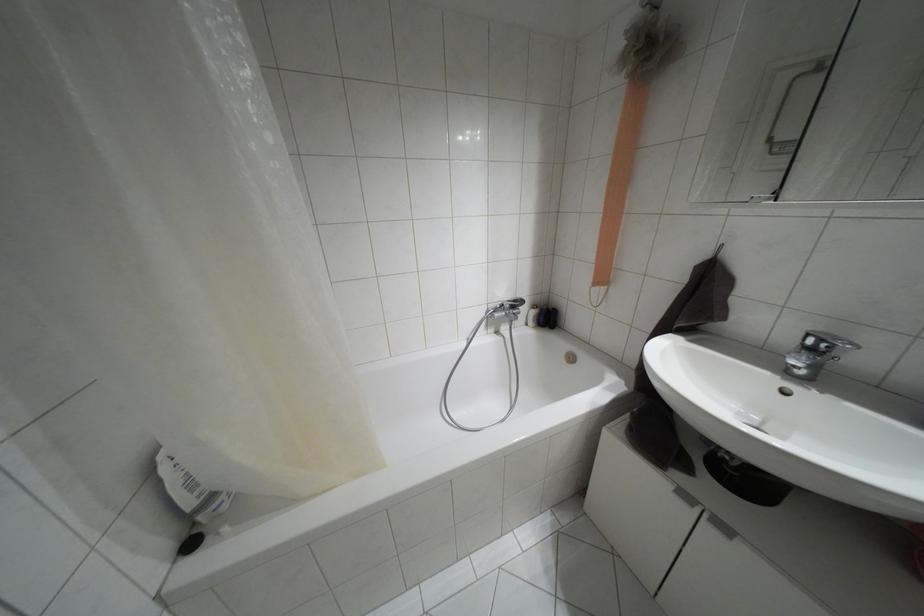
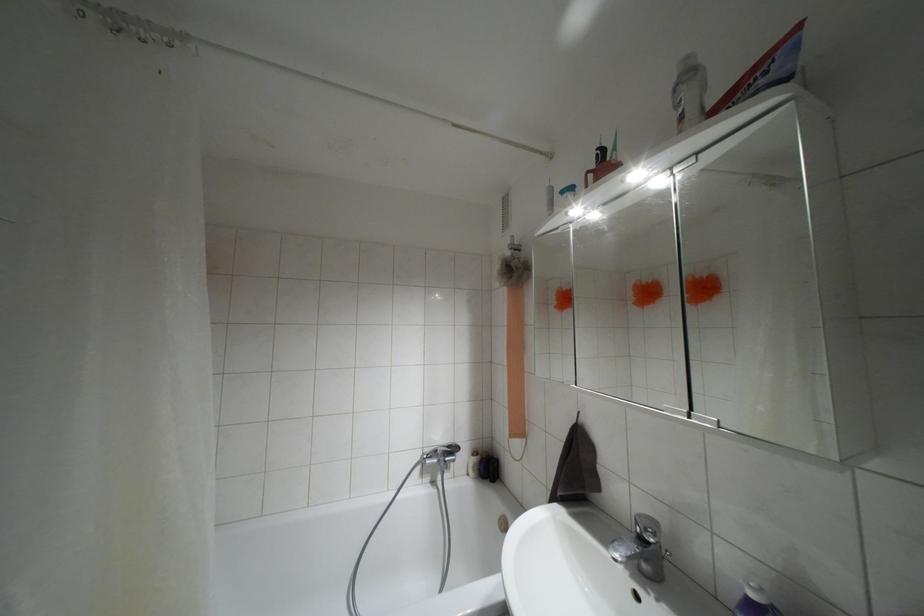
Find the pixel in the second image that matches point (811, 350) in the first image.

(641, 538)